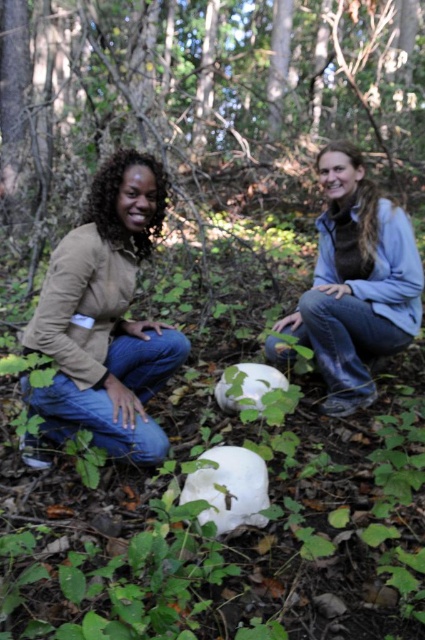
From the picture: You are a photographer trying to capture a closeup of the large white fungi in the forest. You have two points marked in the scene, point A at coordinates point (57, 122) and point B at coordinates point (164, 330). Which point should you position your camera closer to for a better closeup shot of the fungi?

Point A at coordinates point (57, 122) is closer to the viewer than point B at coordinates point (164, 330), so positioning the camera closer to point A would provide a better closeup shot of the fungi.

You are a hiker trying to locate a rough bark tree at center in a forest. You have a map with coordinates. The point marked at [201,99] on the map indicates a specific location. Which object does this coordinate point to?

The coordinate point [201,99] corresponds to the rough bark tree at center.